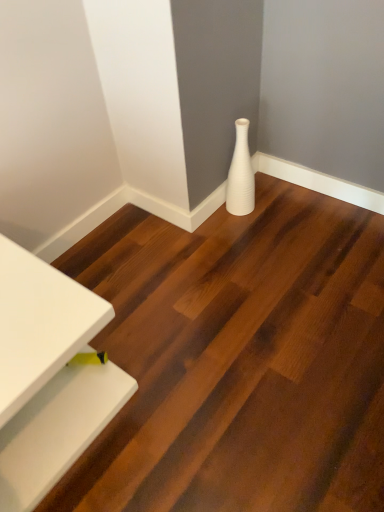
Locate an element on the screen. The height and width of the screenshot is (512, 384). vacant area that lies between white glossy table at lower left and white ribbed vase at lower right is located at coordinates (158, 281).